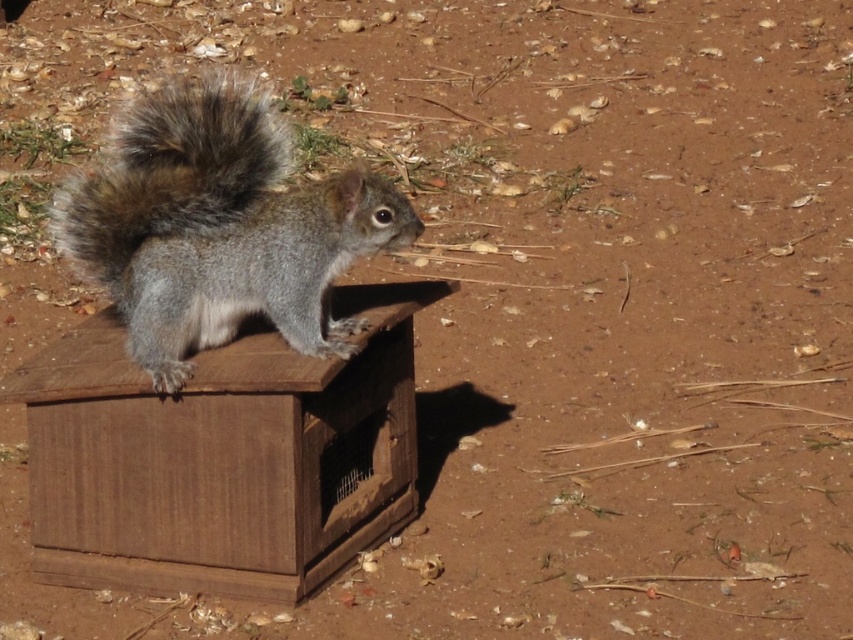
Does gray furry squirrel on the left come in front of fuzzy fur tail at upper center?

That is True.

In order to click on gray furry squirrel on the left in this screenshot , I will do `click(218, 227)`.

Does wooden crate at center have a smaller size compared to fuzzy fur tail at upper center?

Correct, wooden crate at center occupies less space than fuzzy fur tail at upper center.

This screenshot has height=640, width=853. In order to click on wooden crate at center in this screenshot , I will do `click(222, 456)`.

The height and width of the screenshot is (640, 853). Identify the location of wooden crate at center. (222, 456).

Does wooden crate at center appear on the left side of gray furry squirrel on the left?

Yes, wooden crate at center is to the left of gray furry squirrel on the left.

Is the position of wooden crate at center less distant than that of gray furry squirrel on the left?

Yes.

Is point (45, 358) behind point (376, 182)?

That is True.

Where is `wooden crate at center`? This screenshot has height=640, width=853. wooden crate at center is located at coordinates (222, 456).